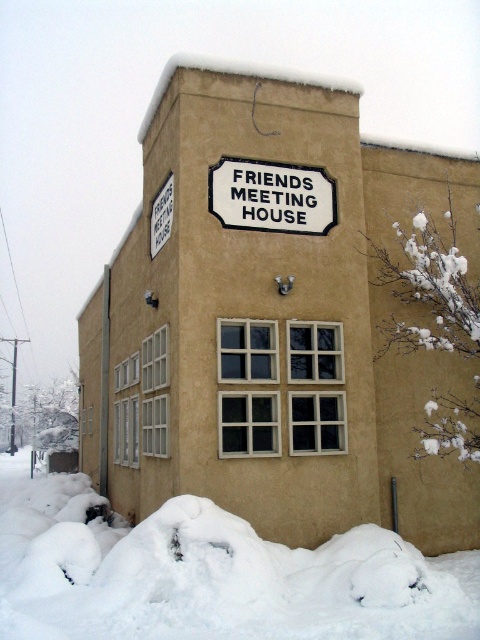
Question: Which object is farther from the camera taking this photo?

Choices:
 (A) white enamel sign at center
 (B) white fluffy snow at lower center

Answer: (A)

Question: Is white fluffy snow at lower center below white enamel sign at center?

Choices:
 (A) yes
 (B) no

Answer: (A)

Question: Which of the following is the closest to the observer?

Choices:
 (A) (260, 209)
 (B) (272, 611)

Answer: (B)

Question: Does white fluffy snow at lower center appear on the right side of white enamel sign at center?

Choices:
 (A) yes
 (B) no

Answer: (B)

Question: Can you confirm if white fluffy snow at lower center is positioned to the right of white enamel sign at center?

Choices:
 (A) yes
 (B) no

Answer: (B)